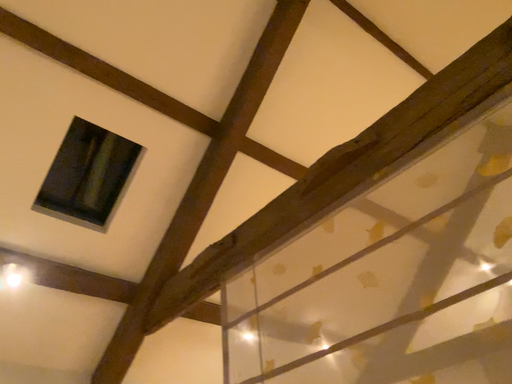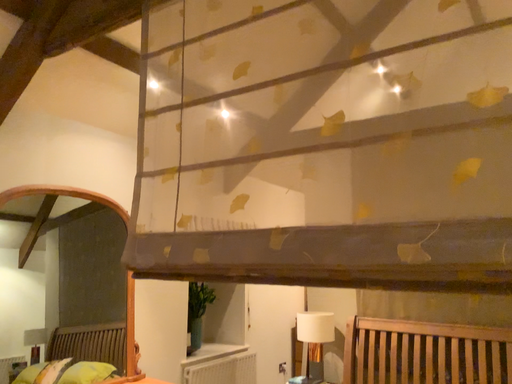
Question: How did the camera likely rotate when shooting the video?

Choices:
 (A) rotated left
 (B) rotated right

Answer: (B)